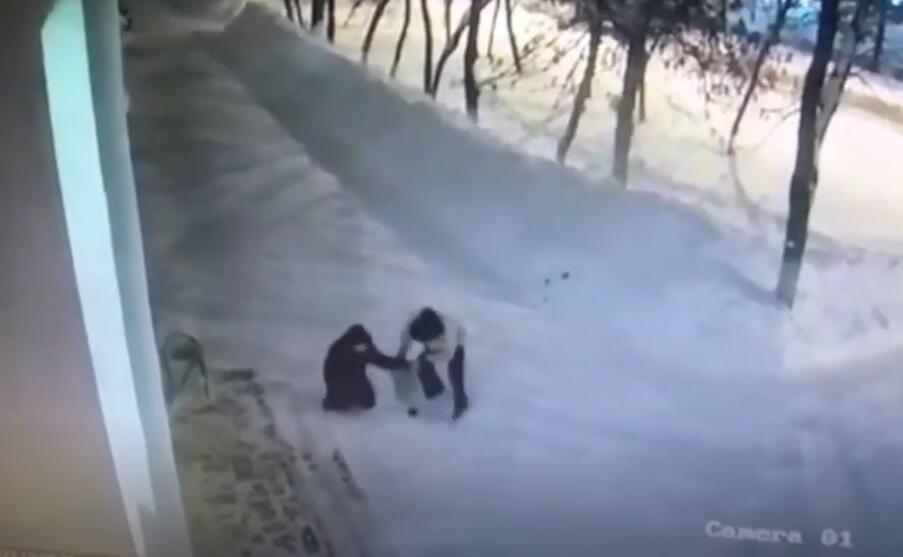
At what (x,y) coordinates should I click in order to perform the action: click on furniture. Please return your answer as a coordinate pair (x, y). Image resolution: width=903 pixels, height=557 pixels. Looking at the image, I should click on (x=194, y=350).